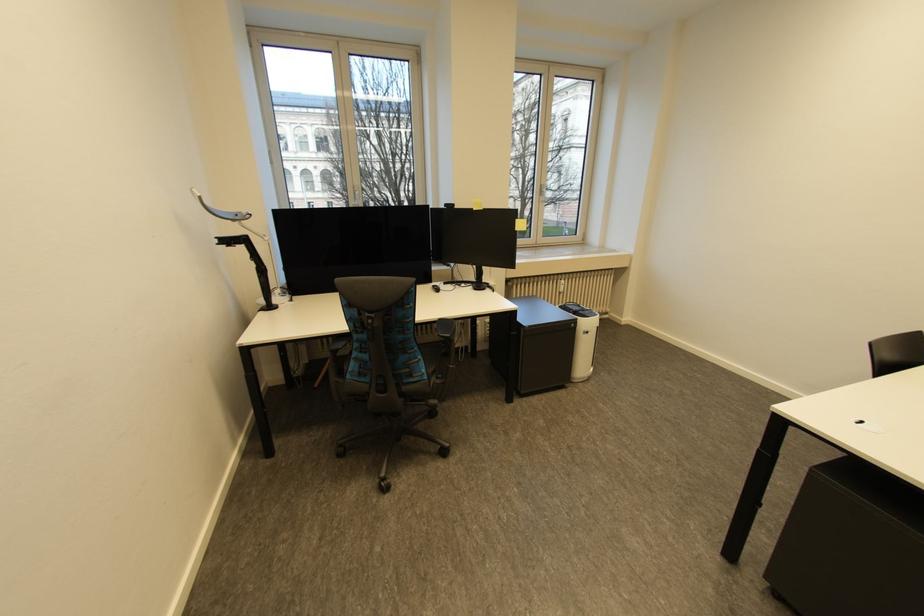
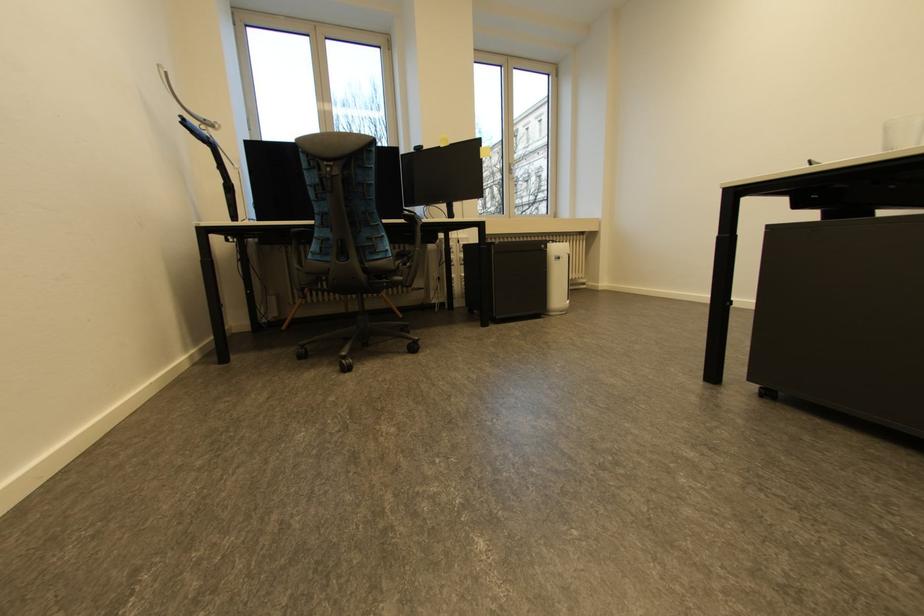
In a continuous first-person perspective shot, in which direction is the camera moving?

The cameraman moved toward right, forward.